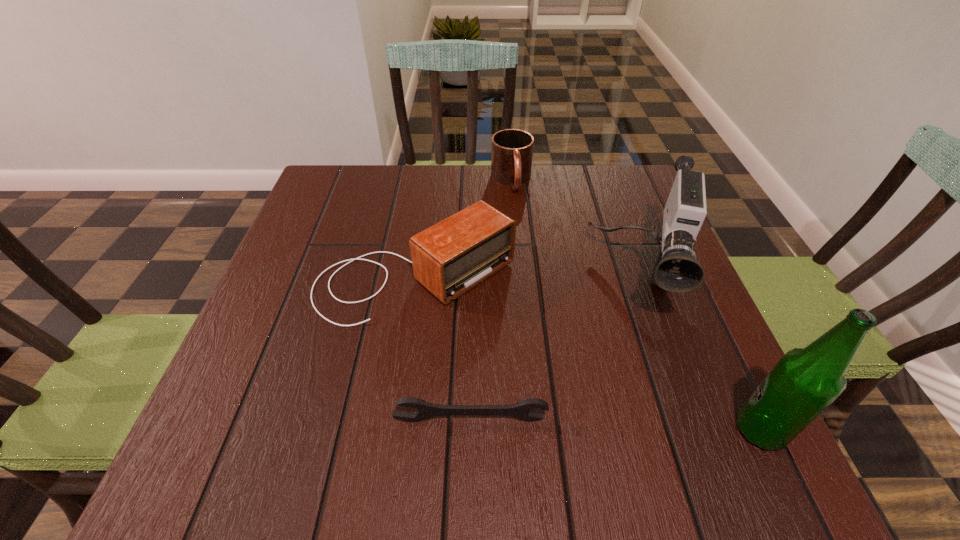
Where is `object present at the near right corner`? object present at the near right corner is located at coordinates (805, 381).

This screenshot has height=540, width=960. What are the coordinates of `vacant space at the far edge of the desktop` in the screenshot? It's located at (569, 192).

Identify the location of vacant space at the near edge. The height and width of the screenshot is (540, 960). (612, 402).

At what (x,y) coordinates should I click in order to perform the action: click on vacant space at the left edge of the desktop. Please return your answer as a coordinate pair (x, y). This screenshot has height=540, width=960. Looking at the image, I should click on (300, 328).

The height and width of the screenshot is (540, 960). I want to click on vacant position at the right edge of the desktop, so click(x=648, y=241).

The height and width of the screenshot is (540, 960). I want to click on vacant point at the far left corner, so click(x=362, y=187).

In the image, there is a desktop. Where is `free space at the far right corner`? free space at the far right corner is located at coordinates click(x=596, y=169).

Find the location of a particular element. The width and height of the screenshot is (960, 540). blank space at the near right corner of the desktop is located at coordinates click(x=657, y=418).

The height and width of the screenshot is (540, 960). I want to click on vacant area between the wrench and the beer bottle, so click(x=615, y=425).

Where is `vacant space that's between the beer bottle and the wrench`? This screenshot has width=960, height=540. vacant space that's between the beer bottle and the wrench is located at coordinates (615, 425).